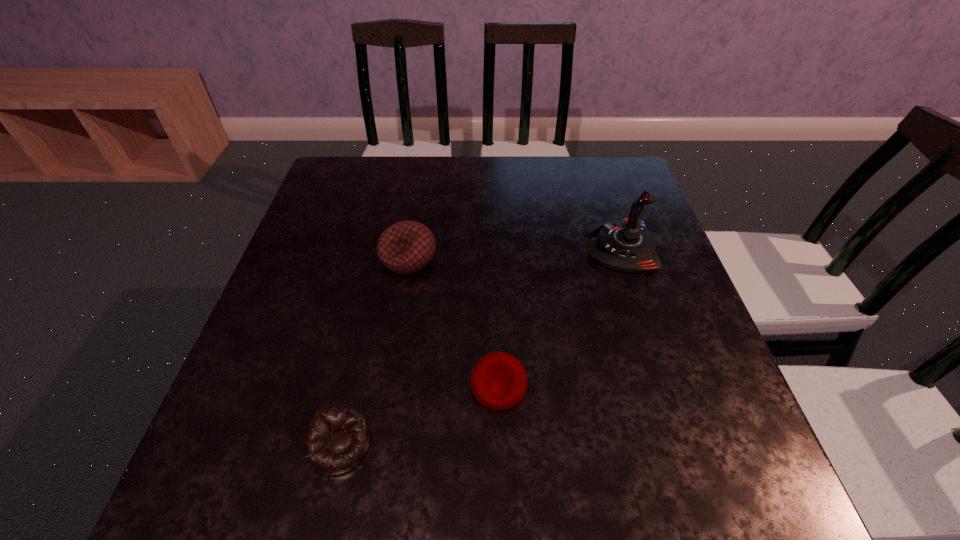
This screenshot has width=960, height=540. In the image, there is a desktop. In order to click on blank space at the far left corner in this screenshot , I will do `click(326, 185)`.

Image resolution: width=960 pixels, height=540 pixels. In order to click on blank space at the near right corner in this screenshot , I will do `click(751, 500)`.

Identify the location of unoccupied position between the second shortest beanbag and the shortest beanbag. The width and height of the screenshot is (960, 540). point(420,415).

Where is `unoccupied area between the rightmost object and the rightmost beanbag`? Image resolution: width=960 pixels, height=540 pixels. unoccupied area between the rightmost object and the rightmost beanbag is located at coordinates (560, 315).

Locate an element on the screen. This screenshot has height=540, width=960. vacant point located between the third farthest object and the rightmost object is located at coordinates (560, 315).

Where is `free space between the tallest object and the second tallest object`? The height and width of the screenshot is (540, 960). free space between the tallest object and the second tallest object is located at coordinates (515, 252).

Locate an element on the screen. The image size is (960, 540). vacant region between the second object from right to left and the joystick is located at coordinates (560, 315).

Where is `empty space between the tallest object and the second tallest object`? The height and width of the screenshot is (540, 960). empty space between the tallest object and the second tallest object is located at coordinates (515, 252).

Locate an element on the screen. Image resolution: width=960 pixels, height=540 pixels. free space between the nearest object and the farthest beanbag is located at coordinates (374, 350).

Identify the location of empty location between the second shortest beanbag and the nearest beanbag. Image resolution: width=960 pixels, height=540 pixels. tap(420, 415).